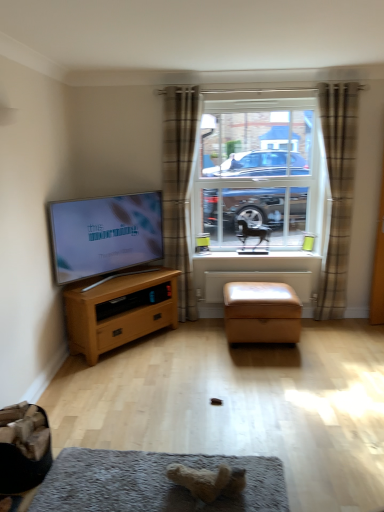
The image size is (384, 512). I want to click on empty space that is to the right of fuzzy beige teddy bear at lower center, acting as the 2th animal starting from the back, so click(x=267, y=482).